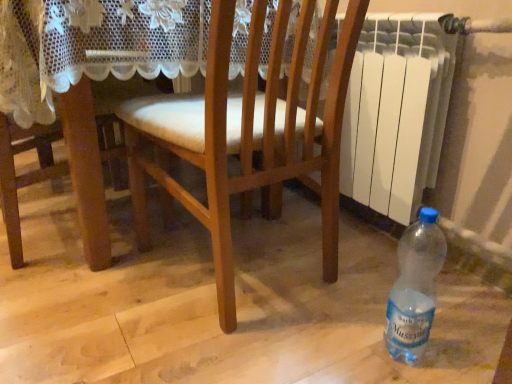
What are the coordinates of `vacant area that is situated to the right of translucent plastic bottle at lower right` in the screenshot? It's located at (459, 341).